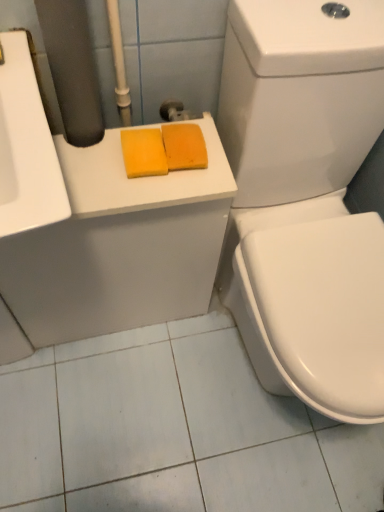
Question: Considering the relative sizes of yellow sponge at center, the 2th soap in the right-to-left sequence, and orange sponge at upper center, acting as the second soap starting from the left, in the image provided, is yellow sponge at center, the 2th soap in the right-to-left sequence, smaller than orange sponge at upper center, acting as the second soap starting from the left,?

Choices:
 (A) no
 (B) yes

Answer: (B)

Question: Does yellow sponge at center, the 2th soap in the right-to-left sequence, have a larger size compared to orange sponge at upper center, which appears as the first soap when viewed from the right?

Choices:
 (A) no
 (B) yes

Answer: (A)

Question: Can you confirm if yellow sponge at center, which is the first soap in left-to-right order, is taller than orange sponge at upper center, acting as the second soap starting from the left?

Choices:
 (A) no
 (B) yes

Answer: (A)

Question: Is yellow sponge at center, the 2th soap in the right-to-left sequence, to the left of orange sponge at upper center, acting as the second soap starting from the left, from the viewer's perspective?

Choices:
 (A) yes
 (B) no

Answer: (A)

Question: Is yellow sponge at center, the 2th soap in the right-to-left sequence, positioned with its back to orange sponge at upper center, which appears as the first soap when viewed from the right?

Choices:
 (A) no
 (B) yes

Answer: (A)

Question: Does yellow sponge at center, which is the first soap in left-to-right order, have a lesser height compared to orange sponge at upper center, which appears as the first soap when viewed from the right?

Choices:
 (A) no
 (B) yes

Answer: (A)

Question: From a real-world perspective, is yellow sponge at upper left on top of orange sponge at upper center, acting as the second soap starting from the left?

Choices:
 (A) yes
 (B) no

Answer: (B)

Question: Is yellow sponge at upper left shorter than orange sponge at upper center, acting as the second soap starting from the left?

Choices:
 (A) yes
 (B) no

Answer: (B)

Question: Is yellow sponge at upper left bigger than orange sponge at upper center, which appears as the first soap when viewed from the right?

Choices:
 (A) no
 (B) yes

Answer: (B)

Question: Is yellow sponge at upper left at the right side of orange sponge at upper center, which appears as the first soap when viewed from the right?

Choices:
 (A) no
 (B) yes

Answer: (A)

Question: From a real-world perspective, is yellow sponge at upper left positioned under orange sponge at upper center, which appears as the first soap when viewed from the right, based on gravity?

Choices:
 (A) yes
 (B) no

Answer: (A)

Question: Is orange sponge at upper center, acting as the second soap starting from the left, at the back of yellow sponge at upper left?

Choices:
 (A) yes
 (B) no

Answer: (B)

Question: Is yellow sponge at center, which is the first soap in left-to-right order, oriented towards white glossy toilet at right?

Choices:
 (A) no
 (B) yes

Answer: (A)